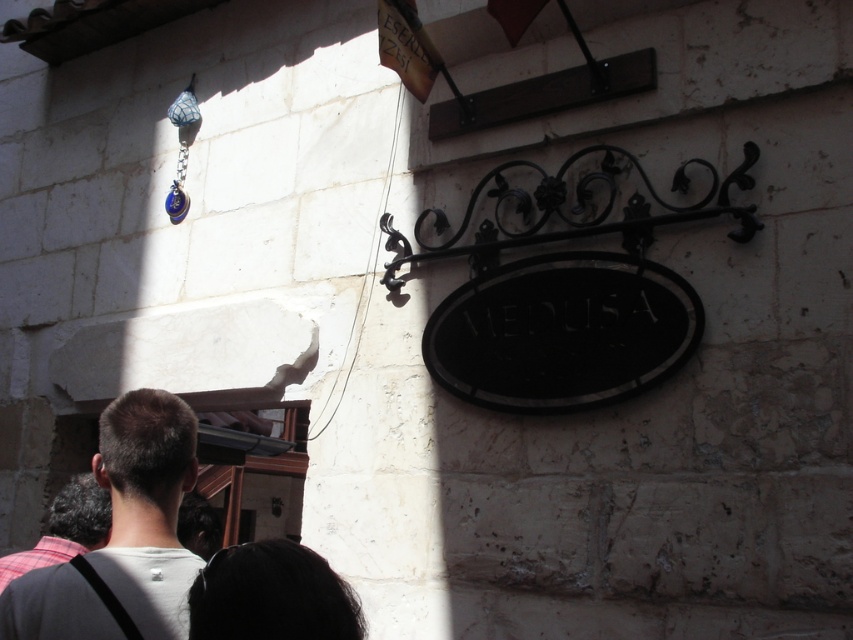
Question: Considering the relative positions of white matte shirt at lower left and black hair at lower center in the image provided, where is white matte shirt at lower left located with respect to black hair at lower center?

Choices:
 (A) above
 (B) below

Answer: (A)

Question: Does white matte shirt at lower left appear on the right side of black hair at lower center?

Choices:
 (A) no
 (B) yes

Answer: (A)

Question: Among these points, which one is farthest from the camera?

Choices:
 (A) (357, 611)
 (B) (38, 548)

Answer: (B)

Question: Considering the real-world distances, which object is closest to the black hair at lower center?

Choices:
 (A) plaid fabric shirt at lower left
 (B) white matte shirt at lower left

Answer: (B)

Question: Which object is the farthest from the white matte shirt at lower left?

Choices:
 (A) plaid fabric shirt at lower left
 (B) black hair at lower center

Answer: (A)

Question: Can you confirm if black hair at lower center is thinner than plaid fabric shirt at lower left?

Choices:
 (A) yes
 (B) no

Answer: (B)